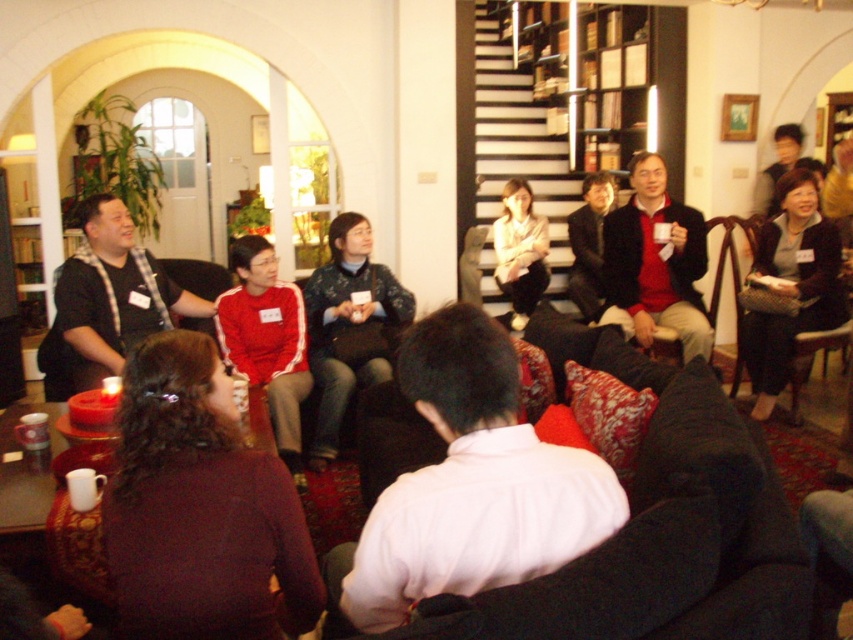
Question: Which point is closer to the camera taking this photo?

Choices:
 (A) (805, 186)
 (B) (303, 289)
 (C) (657, 216)
 (D) (222, 324)

Answer: (D)

Question: Does dark blue textured sweater at center appear under matte black jacket at center?

Choices:
 (A) yes
 (B) no

Answer: (A)

Question: Does dark blue textured sweater at center appear on the right side of red fabric jacket at center?

Choices:
 (A) yes
 (B) no

Answer: (A)

Question: Which object is closer to the camera taking this photo?

Choices:
 (A) dark gray sweater at center
 (B) red fabric jacket at center
 (C) matte black jacket at center
 (D) dark blue textured sweater at center

Answer: (B)

Question: Is matte black jacket at center to the left of red fabric jacket at center from the viewer's perspective?

Choices:
 (A) yes
 (B) no

Answer: (B)

Question: Which is nearer to the dark blue textured sweater at center?

Choices:
 (A) dark gray sweater at center
 (B) matte black jacket at center
 (C) red fabric jacket at center
 (D) matte black shirt at left

Answer: (C)